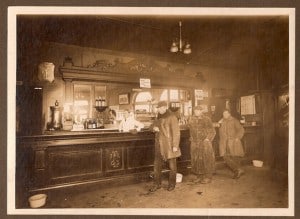
Find the location of a particular element. This screenshot has width=300, height=219. lamp is located at coordinates (173, 46).